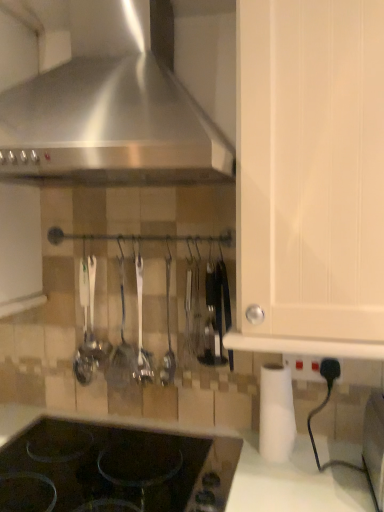
Question: Is stainless steel range hood at upper left positioned far away from white matte paper towel at lower right?

Choices:
 (A) yes
 (B) no

Answer: (B)

Question: Does stainless steel range hood at upper left have a lesser width compared to white matte paper towel at lower right?

Choices:
 (A) no
 (B) yes

Answer: (A)

Question: Does stainless steel range hood at upper left have a smaller size compared to white matte paper towel at lower right?

Choices:
 (A) yes
 (B) no

Answer: (B)

Question: Considering the relative sizes of stainless steel range hood at upper left and white matte paper towel at lower right in the image provided, is stainless steel range hood at upper left taller than white matte paper towel at lower right?

Choices:
 (A) yes
 (B) no

Answer: (A)

Question: Considering the relative sizes of stainless steel range hood at upper left and white matte paper towel at lower right in the image provided, is stainless steel range hood at upper left wider than white matte paper towel at lower right?

Choices:
 (A) no
 (B) yes

Answer: (B)

Question: From a real-world perspective, is stainless steel range hood at upper left located higher than white matte paper towel at lower right?

Choices:
 (A) no
 (B) yes

Answer: (B)

Question: Is white matte paper towel at lower right located outside black plastic knife at center?

Choices:
 (A) no
 (B) yes

Answer: (B)

Question: Is white matte paper towel at lower right closer to the viewer compared to black plastic knife at center?

Choices:
 (A) yes
 (B) no

Answer: (A)

Question: Would you say white matte paper towel at lower right contains black plastic knife at center?

Choices:
 (A) yes
 (B) no

Answer: (B)

Question: Is white matte paper towel at lower right taller than black plastic knife at center?

Choices:
 (A) no
 (B) yes

Answer: (A)

Question: Is white matte paper towel at lower right positioned with its back to black plastic knife at center?

Choices:
 (A) yes
 (B) no

Answer: (B)

Question: Does white matte paper towel at lower right have a larger size compared to black plastic knife at center?

Choices:
 (A) yes
 (B) no

Answer: (B)

Question: Is white matte paper towel at lower right facing away from stainless steel range hood at upper left?

Choices:
 (A) yes
 (B) no

Answer: (B)